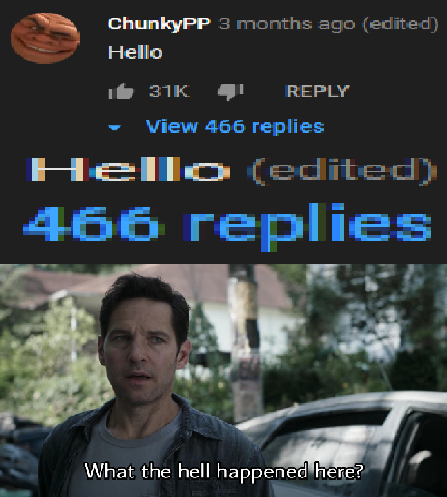
This screenshot has width=447, height=497. Identify the location of frames. (220, 54), (208, 188), (215, 302).